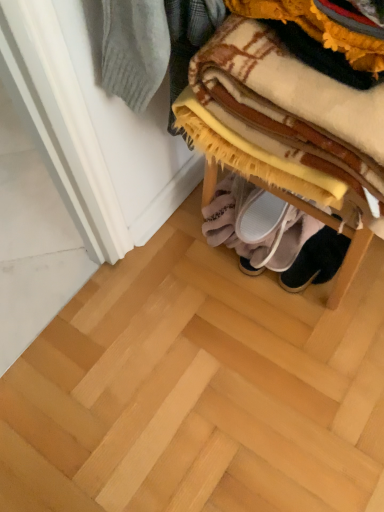
Locate an element on the screen. free space above wooden shoe rack at lower right (from a real-world perspective) is located at coordinates (218, 364).